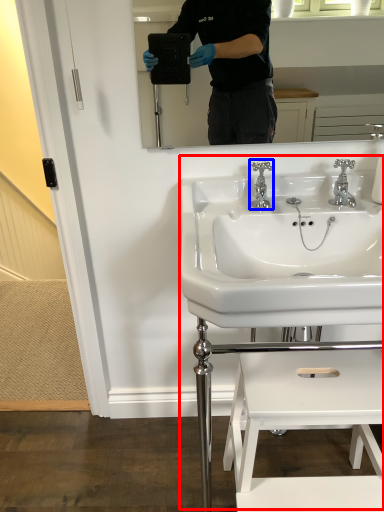
Question: Which object is further to the camera taking this photo, sink (highlighted by a red box) or tap (highlighted by a blue box)?

Choices:
 (A) sink
 (B) tap

Answer: (B)